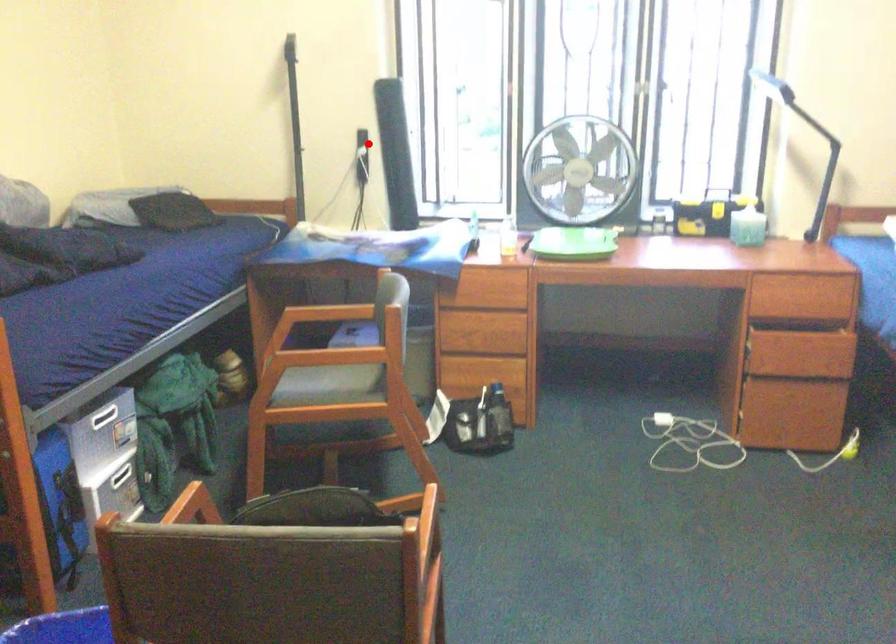
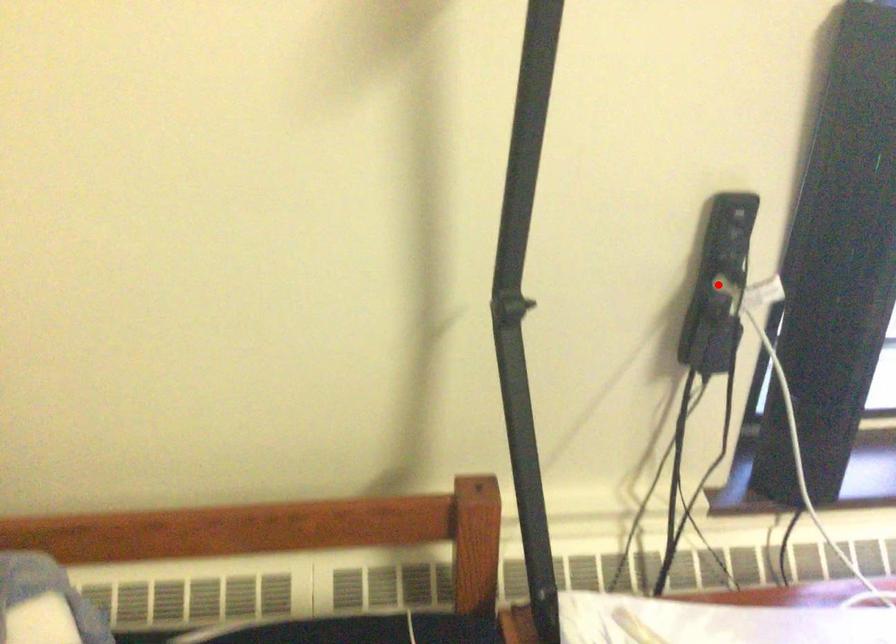
I am providing you with two images of the same scene from different viewpoints. A red point is marked on the first image and another point is marked on the second image. Do the highlighted points in image1 and image2 indicate the same real-world spot?

Yes